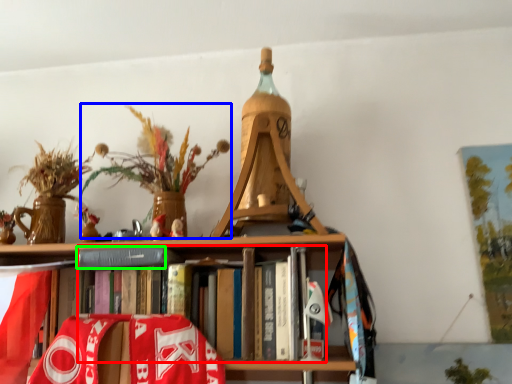
Question: Considering the real-world distances, which object is farthest from book (highlighted by a red box)? floral arrangement (highlighted by a blue box) or paperback book (highlighted by a green box)?

Choices:
 (A) floral arrangement
 (B) paperback book

Answer: (A)